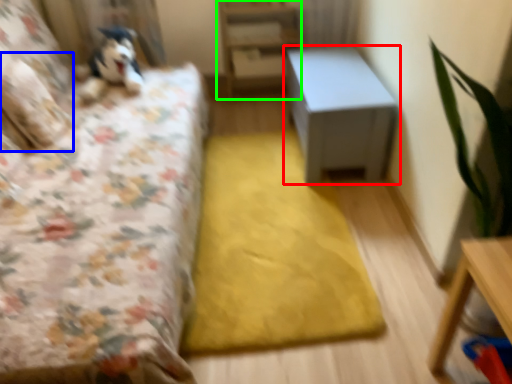
Question: Which object is the closest to the table (highlighted by a red box)? Choose among these: pillow (highlighted by a blue box) or bookshelf (highlighted by a green box).

Choices:
 (A) pillow
 (B) bookshelf

Answer: (B)